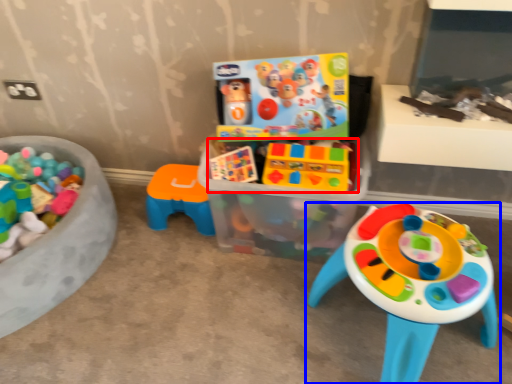
Question: Which of the following is the closest to the observer, toy (highlighted by a red box) or toy (highlighted by a blue box)?

Choices:
 (A) toy
 (B) toy

Answer: (B)